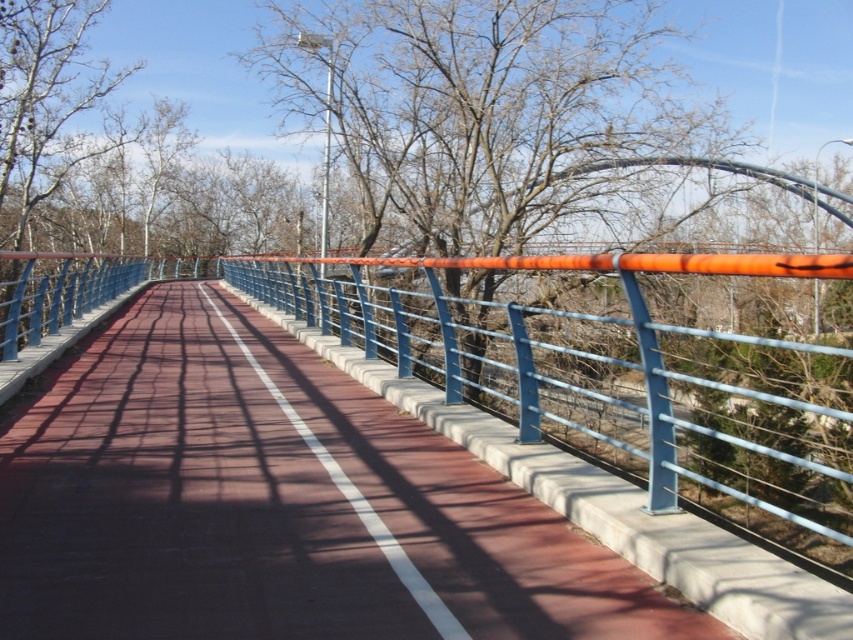
Identify the location of smooth concrete path at center. (276, 502).

Based on the photo, does smooth concrete path at center have a greater width compared to bare branches at upper center?

No.

Is point (96, 451) positioned behind point (450, 84)?

No, it is not.

Image resolution: width=853 pixels, height=640 pixels. I want to click on smooth concrete path at center, so click(x=276, y=502).